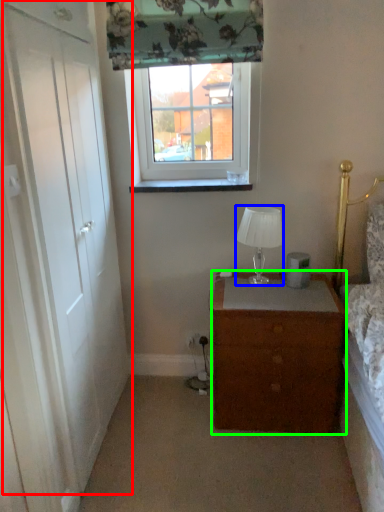
Question: Estimate the real-world distances between objects in this image. Which object is farther from door (highlighted by a red box), lamp (highlighted by a blue box) or chest of drawers (highlighted by a green box)?

Choices:
 (A) lamp
 (B) chest of drawers

Answer: (A)